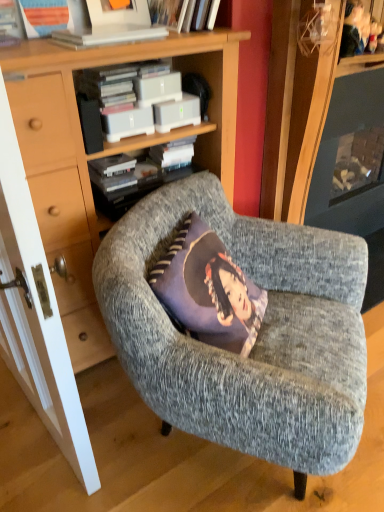
Question: From the image's perspective, is white wood door at left under white matte book at upper center?

Choices:
 (A) yes
 (B) no

Answer: (A)

Question: From a real-world perspective, is white wood door at left physically above white matte book at upper center?

Choices:
 (A) no
 (B) yes

Answer: (A)

Question: Is white wood door at left turned away from white matte book at upper center?

Choices:
 (A) no
 (B) yes

Answer: (B)

Question: Considering the relative sizes of white wood door at left and white matte book at upper center in the image provided, is white wood door at left thinner than white matte book at upper center?

Choices:
 (A) no
 (B) yes

Answer: (B)

Question: Is the position of white wood door at left more distant than that of white matte book at upper center?

Choices:
 (A) no
 (B) yes

Answer: (A)

Question: From their relative heights in the image, would you say wooden bookcase at center is taller or shorter than textured gray armchair at center?

Choices:
 (A) short
 (B) tall

Answer: (B)

Question: Considering the positions of point 168,50 and point 145,377, is point 168,50 closer or farther from the camera than point 145,377?

Choices:
 (A) closer
 (B) farther

Answer: (B)

Question: Is wooden bookcase at center wider or thinner than textured gray armchair at center?

Choices:
 (A) thin
 (B) wide

Answer: (A)

Question: Choose the correct answer: Is wooden bookcase at center inside textured gray armchair at center or outside it?

Choices:
 (A) inside
 (B) outside

Answer: (B)

Question: Considering the positions of point (56, 31) and point (1, 266), is point (56, 31) closer or farther from the camera than point (1, 266)?

Choices:
 (A) farther
 (B) closer

Answer: (A)

Question: Considering the positions of white plastic book at upper center and white wood door at left in the image, is white plastic book at upper center wider or thinner than white wood door at left?

Choices:
 (A) thin
 (B) wide

Answer: (B)

Question: Based on their sizes in the image, would you say white plastic book at upper center is bigger or smaller than white wood door at left?

Choices:
 (A) big
 (B) small

Answer: (B)

Question: Considering their positions, is white plastic book at upper center located in front of or behind white wood door at left?

Choices:
 (A) behind
 (B) front

Answer: (A)

Question: Considering their positions, is textured gray armchair at center located in front of or behind white plastic book at upper center?

Choices:
 (A) behind
 (B) front

Answer: (B)

Question: Is textured gray armchair at center bigger or smaller than white plastic book at upper center?

Choices:
 (A) big
 (B) small

Answer: (A)